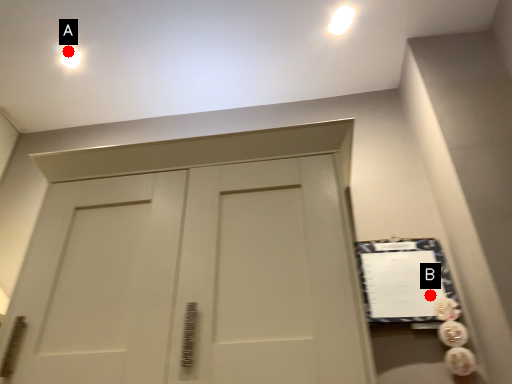
Question: Two points are circled on the image, labeled by A and B beside each circle. Which point is farther from the camera taking this photo?

Choices:
 (A) A is further
 (B) B is further

Answer: (A)